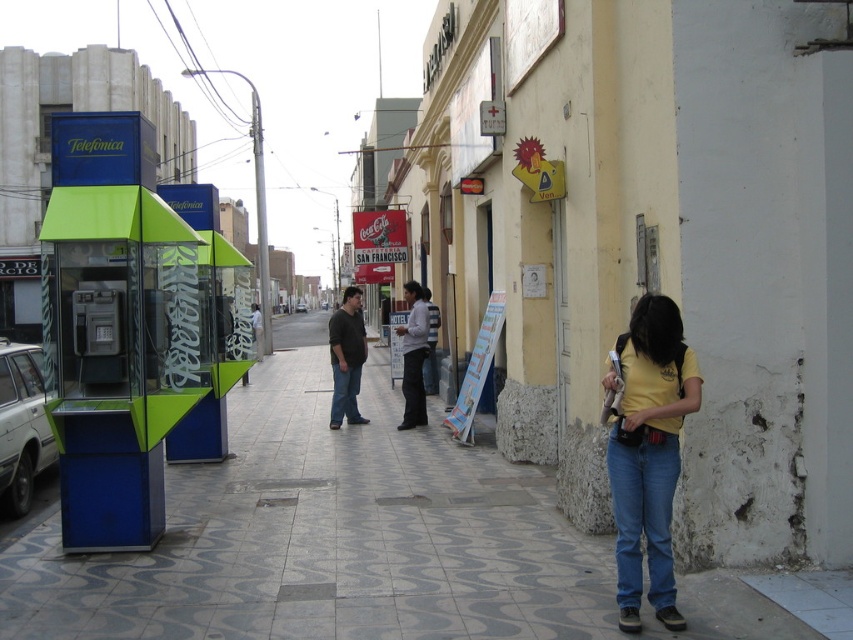
You are a delivery robot with a 30 feet range. You are at the blue denim jeans at center and need to deliver a package to the yellow matte shirt at lower right. Can you reach them without moving?

The distance between the yellow matte shirt at lower right and the blue denim jeans at center is 25.60 feet, which is within the robot delivery range of 30 feet. Therefore, the delivery robot can reach the yellow matte shirt at lower right without moving.

You are a photographer trying to capture a candid shot of both the yellow matte shirt at lower right and the blue denim jeans at center. Since you want to ensure both subjects are clearly visible in the frame, which subject should you adjust your camera focus to prioritize based on their sizes?

The yellow matte shirt at lower right has a larger width than the blue denim jeans at center, so you should prioritize focusing on the yellow matte shirt at lower right to ensure clarity given its size.

Consider the image. You are a photographer trying to capture a candid shot of the two people at the center of the image. The camera you are using has a maximum focus range of 36 inches. Can you get both the white shirt at center and blue denim jeans at center in focus without moving the camera?

The white shirt at center and blue denim jeans at center are 36.72 inches apart. Since the camera can only focus up to 36 inches, the distance between them exceeds the focus range. Therefore, you cannot get both in focus without adjusting the camera settings or moving closer.